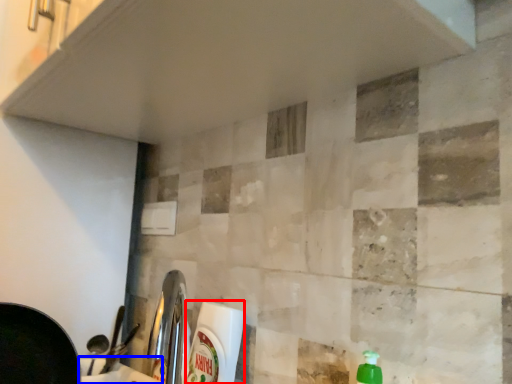
Question: Which object is further to the camera taking this photo, cleaning product (highlighted by a red box) or counter top (highlighted by a blue box)?

Choices:
 (A) cleaning product
 (B) counter top

Answer: (A)